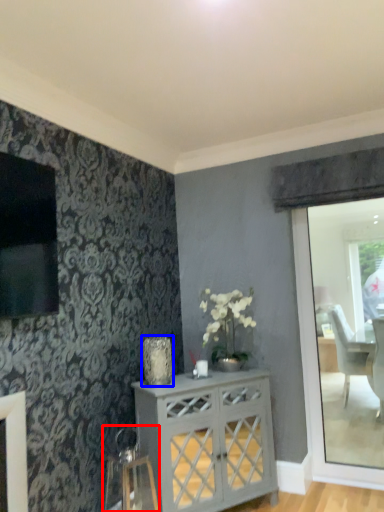
Question: Which point is closer to the camera, swivel chair (highlighted by a red box) or vase (highlighted by a blue box)?

Choices:
 (A) swivel chair
 (B) vase

Answer: (A)